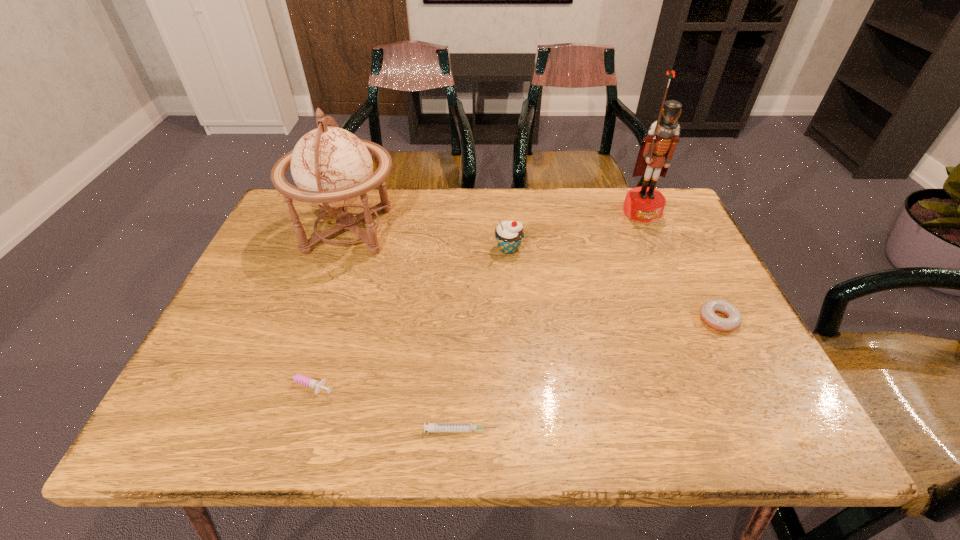
Locate an element on the screen. The image size is (960, 540). free space in the image that satisfies the following two spatial constraints: 1. at the front of the fifth shortest object showing Africa; 2. on the left side of the third tallest object is located at coordinates (343, 249).

Identify the location of free spot that satisfies the following two spatial constraints: 1. at the front of the third tallest object showing Africa; 2. on the left side of the fifth shortest object. (343, 249).